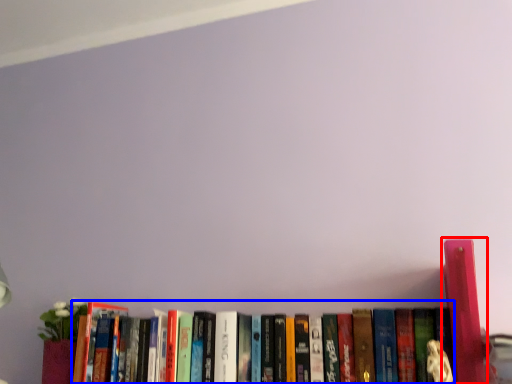
Question: Which of the following is the farthest to the observer, book (highlighted by a red box) or book (highlighted by a blue box)?

Choices:
 (A) book
 (B) book

Answer: (B)